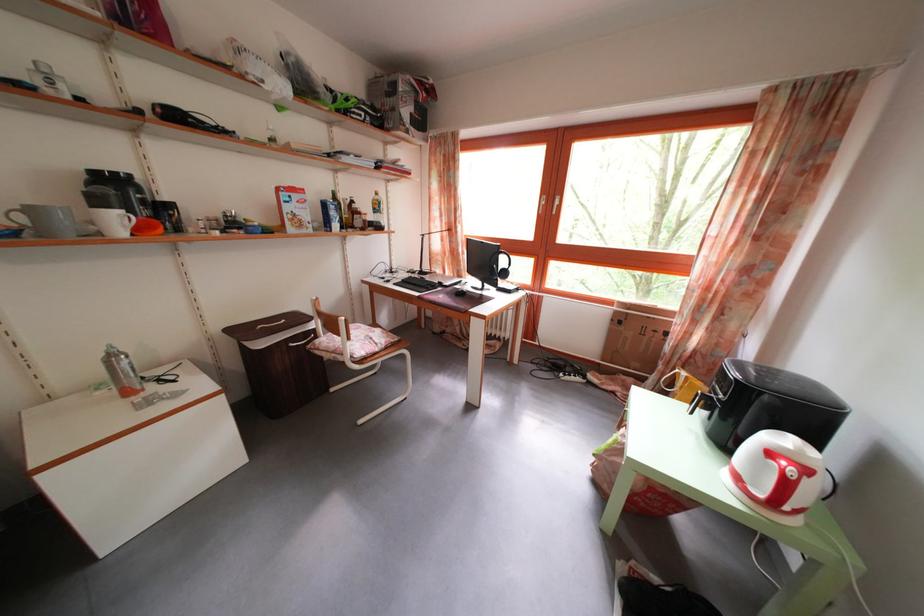
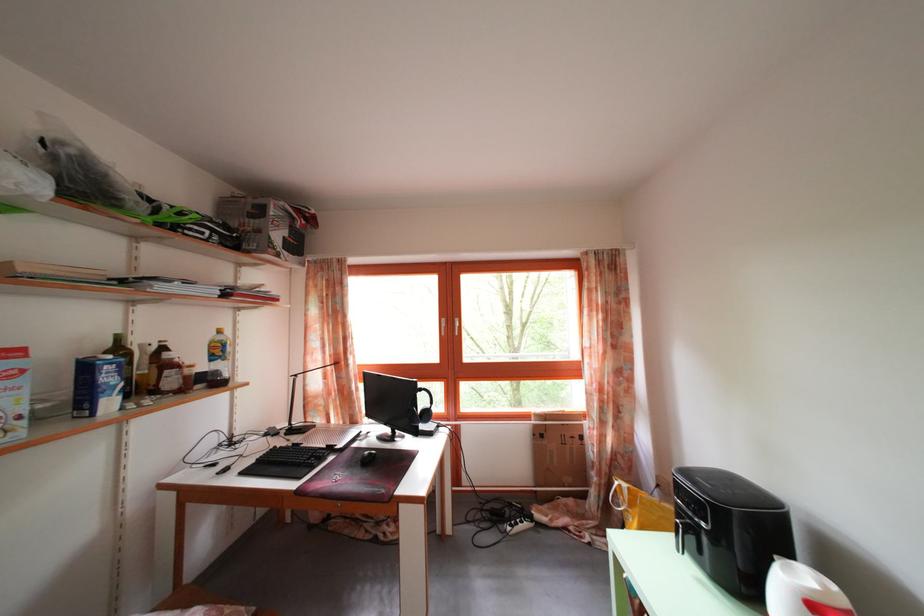
Locate, in the second image, the point that corresponds to point 344,233 in the first image.

(117, 410)